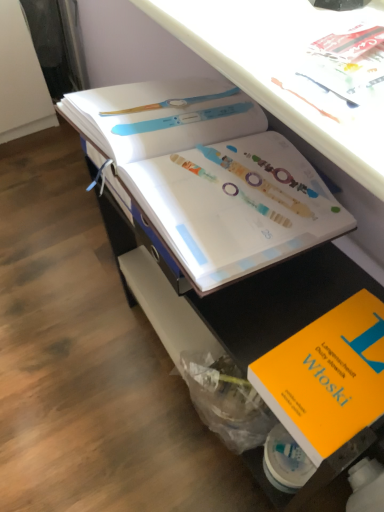
Describe the element at coordinates (209, 175) in the screenshot. I see `white paper book at center, marked as the second book in a bottom-to-top arrangement` at that location.

The width and height of the screenshot is (384, 512). I want to click on white paper book at center, marked as the second book in a bottom-to-top arrangement, so click(209, 175).

How much space does orange matte book at lower right, which ranks as the 1th book in bottom-to-top order, occupy vertically?

orange matte book at lower right, which ranks as the 1th book in bottom-to-top order, is 2.44 inches tall.

The width and height of the screenshot is (384, 512). What do you see at coordinates (327, 376) in the screenshot?
I see `orange matte book at lower right, the 2th book when ordered from top to bottom` at bounding box center [327, 376].

In order to click on orange matte book at lower right, which ranks as the 1th book in bottom-to-top order in this screenshot , I will do `click(327, 376)`.

I want to click on white paper book at center, marked as the second book in a bottom-to-top arrangement, so click(x=209, y=175).

Is white paper book at center, marked as the second book in a bottom-to-top arrangement, to the left of orange matte book at lower right, which ranks as the 1th book in bottom-to-top order, from the viewer's perspective?

Indeed, white paper book at center, marked as the second book in a bottom-to-top arrangement, is positioned on the left side of orange matte book at lower right, which ranks as the 1th book in bottom-to-top order.

In the scene shown: Is white paper book at center, which appears as the first book when viewed from the top, positioned behind orange matte book at lower right, which ranks as the 1th book in bottom-to-top order?

Yes.

Considering the points (279, 170) and (331, 428), which point is in front, point (279, 170) or point (331, 428)?

The point (331, 428) is more forward.

From the image's perspective, which one is positioned lower, white paper book at center, marked as the second book in a bottom-to-top arrangement, or orange matte book at lower right, which ranks as the 1th book in bottom-to-top order?

From the image's view, orange matte book at lower right, which ranks as the 1th book in bottom-to-top order, is below.

From a real-world perspective, which object stands above the other?

In real-world perspective, white paper book at center, marked as the second book in a bottom-to-top arrangement, is above.

Considering the relative sizes of white paper book at center, marked as the second book in a bottom-to-top arrangement, and orange matte book at lower right, which ranks as the 1th book in bottom-to-top order, in the image provided, is white paper book at center, marked as the second book in a bottom-to-top arrangement, wider than orange matte book at lower right, which ranks as the 1th book in bottom-to-top order,?

Yes.

Considering the relative sizes of white paper book at center, which appears as the first book when viewed from the top, and orange matte book at lower right, the 2th book when ordered from top to bottom, in the image provided, is white paper book at center, which appears as the first book when viewed from the top, shorter than orange matte book at lower right, the 2th book when ordered from top to bottom,?

In fact, white paper book at center, which appears as the first book when viewed from the top, may be taller than orange matte book at lower right, the 2th book when ordered from top to bottom.

Is white paper book at center, which appears as the first book when viewed from the top, smaller than orange matte book at lower right, which ranks as the 1th book in bottom-to-top order?

Incorrect, white paper book at center, which appears as the first book when viewed from the top, is not smaller in size than orange matte book at lower right, which ranks as the 1th book in bottom-to-top order.

Is orange matte book at lower right, the 2th book when ordered from top to bottom, inside white paper book at center, which appears as the first book when viewed from the top?

No, orange matte book at lower right, the 2th book when ordered from top to bottom, is not a part of white paper book at center, which appears as the first book when viewed from the top.

Would you say white paper book at center, which appears as the first book when viewed from the top, is a long distance from orange matte book at lower right, which ranks as the 1th book in bottom-to-top order?

They are positioned close to each other.

Is white paper book at center, marked as the second book in a bottom-to-top arrangement, turned away from orange matte book at lower right, which ranks as the 1th book in bottom-to-top order?

No, orange matte book at lower right, which ranks as the 1th book in bottom-to-top order, is not at the back of white paper book at center, marked as the second book in a bottom-to-top arrangement.

How different are the orientations of white paper book at center, marked as the second book in a bottom-to-top arrangement, and orange matte book at lower right, which ranks as the 1th book in bottom-to-top order, in degrees?

0.000353 degrees separate the facing orientations of white paper book at center, marked as the second book in a bottom-to-top arrangement, and orange matte book at lower right, which ranks as the 1th book in bottom-to-top order.

Measure the distance from white paper book at center, marked as the second book in a bottom-to-top arrangement, to orange matte book at lower right, the 2th book when ordered from top to bottom.

The distance of white paper book at center, marked as the second book in a bottom-to-top arrangement, from orange matte book at lower right, the 2th book when ordered from top to bottom, is 24.76 centimeters.

You are a GUI agent. You are given a task and a screenshot of the screen. Output one action in this format:
    pyautogui.click(x=<x>, y=<y>)
    Task: Click on the book above the orange matte book at lower right, the 2th book when ordered from top to bottom (from a real-world perspective)
    
    Given the screenshot: What is the action you would take?
    pyautogui.click(x=209, y=175)

Is orange matte book at lower right, which ranks as the 1th book in bottom-to-top order, at the left side of white paper book at center, which appears as the first book when viewed from the top?

No, orange matte book at lower right, which ranks as the 1th book in bottom-to-top order, is not to the left of white paper book at center, which appears as the first book when viewed from the top.

Considering the relative positions of orange matte book at lower right, which ranks as the 1th book in bottom-to-top order, and white paper book at center, which appears as the first book when viewed from the top, in the image provided, is orange matte book at lower right, which ranks as the 1th book in bottom-to-top order, in front of white paper book at center, which appears as the first book when viewed from the top,?

Yes, orange matte book at lower right, which ranks as the 1th book in bottom-to-top order, is closer to the camera.

Which point is more forward, (382, 336) or (192, 249)?

Positioned in front is point (192, 249).

From the image's perspective, between orange matte book at lower right, the 2th book when ordered from top to bottom, and white paper book at center, marked as the second book in a bottom-to-top arrangement, who is located below?

orange matte book at lower right, the 2th book when ordered from top to bottom, is shown below in the image.

From a real-world perspective, is orange matte book at lower right, the 2th book when ordered from top to bottom, on top of white paper book at center, marked as the second book in a bottom-to-top arrangement?

No, from a real-world perspective, orange matte book at lower right, the 2th book when ordered from top to bottom, is not over white paper book at center, marked as the second book in a bottom-to-top arrangement

In terms of width, does orange matte book at lower right, which ranks as the 1th book in bottom-to-top order, look wider or thinner when compared to white paper book at center, marked as the second book in a bottom-to-top arrangement?

Considering their sizes, orange matte book at lower right, which ranks as the 1th book in bottom-to-top order, looks slimmer than white paper book at center, marked as the second book in a bottom-to-top arrangement.

Considering the relative sizes of orange matte book at lower right, the 2th book when ordered from top to bottom, and white paper book at center, which appears as the first book when viewed from the top, in the image provided, is orange matte book at lower right, the 2th book when ordered from top to bottom, shorter than white paper book at center, which appears as the first book when viewed from the top,?

Yes, orange matte book at lower right, the 2th book when ordered from top to bottom, is shorter than white paper book at center, which appears as the first book when viewed from the top.

Considering the sizes of objects orange matte book at lower right, the 2th book when ordered from top to bottom, and white paper book at center, marked as the second book in a bottom-to-top arrangement, in the image provided, who is smaller, orange matte book at lower right, the 2th book when ordered from top to bottom, or white paper book at center, marked as the second book in a bottom-to-top arrangement,?

With smaller size is orange matte book at lower right, the 2th book when ordered from top to bottom.

Is orange matte book at lower right, the 2th book when ordered from top to bottom, spatially inside white paper book at center, which appears as the first book when viewed from the top, or outside of it?

orange matte book at lower right, the 2th book when ordered from top to bottom, lies outside white paper book at center, which appears as the first book when viewed from the top.

Is orange matte book at lower right, the 2th book when ordered from top to bottom, with white paper book at center, which appears as the first book when viewed from the top?

No, orange matte book at lower right, the 2th book when ordered from top to bottom, is not beside white paper book at center, which appears as the first book when viewed from the top.

Could you tell me if orange matte book at lower right, the 2th book when ordered from top to bottom, is turned towards white paper book at center, marked as the second book in a bottom-to-top arrangement?

No.

Measure the distance from orange matte book at lower right, which ranks as the 1th book in bottom-to-top order, to white paper book at center, marked as the second book in a bottom-to-top arrangement.

They are 24.76 centimeters apart.

Find the location of a particular element. The width and height of the screenshot is (384, 512). book behind the orange matte book at lower right, the 2th book when ordered from top to bottom is located at coordinates (209, 175).

At what (x,y) coordinates should I click in order to perform the action: click on book positioned vertically above the orange matte book at lower right, the 2th book when ordered from top to bottom (from a real-world perspective). Please return your answer as a coordinate pair (x, y). Looking at the image, I should click on (209, 175).

The width and height of the screenshot is (384, 512). I want to click on book that appears on the left of orange matte book at lower right, the 2th book when ordered from top to bottom, so click(x=209, y=175).